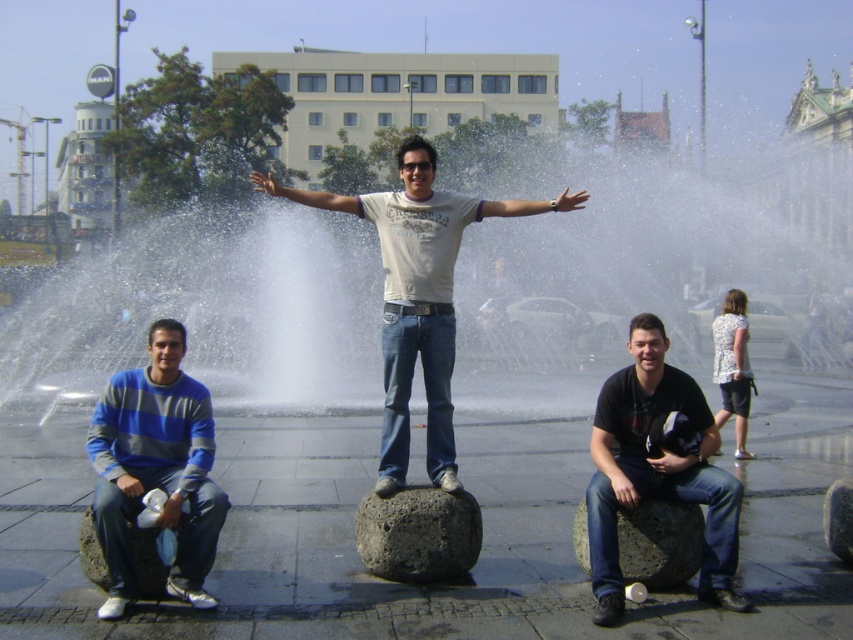
You are standing at the point labeled as point (431, 579) in the image. You want to walk towards the point labeled as point (628, 259). Which direction should you move relative to your current position?

Since point (628, 259) is behind point (431, 579), you should move backward to reach it.

You are standing in the urban scene near the fountain. There are two points marked in the image. The first point is at coordinates point (442,394) and the second point is at point (363,499). If you want to move closer to the camera, which point should you move towards?

You should move towards point (363,499) because it is closer to the camera compared to point (442,394).

You are a photographer trying to capture a candid shot of the white cotton shirt at center and the volcanic rock stone at center. From your current position, which object is positioned to the right of the other?

The white cotton shirt at center is to the right of the volcanic rock stone at center.